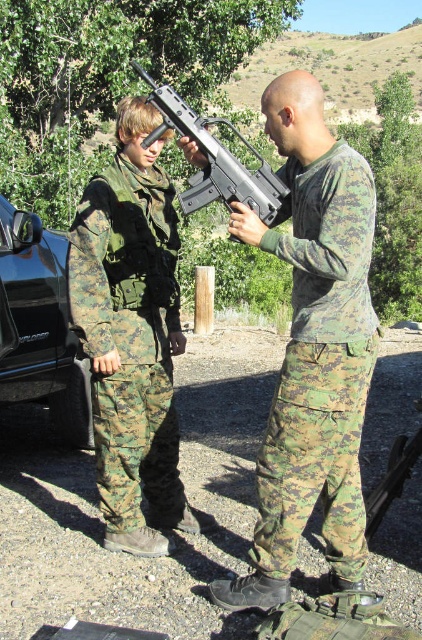
Can you confirm if camouflage fabric uniform at left is positioned to the left of black glossy car at left?

In fact, camouflage fabric uniform at left is to the right of black glossy car at left.

Is point (126, 259) positioned in front of point (62, 385)?

That is True.

Which is behind, point (172, 403) or point (34, 321)?

Positioned behind is point (34, 321).

The image size is (422, 640). Find the location of `camouflage fabric uniform at left`. camouflage fabric uniform at left is located at coordinates (129, 333).

Between point (173, 189) and point (226, 148), which one is positioned in front?

Positioned in front is point (226, 148).

Does camouflage fabric uniform at left come behind metallic gray rifle at center?

Yes, it is.

Locate an element on the screen. Image resolution: width=422 pixels, height=640 pixels. camouflage fabric uniform at left is located at coordinates (129, 333).

This screenshot has width=422, height=640. Find the location of `camouflage fabric uniform at left`. camouflage fabric uniform at left is located at coordinates (129, 333).

You are a GUI agent. You are given a task and a screenshot of the screen. Output one action in this format:
    pyautogui.click(x=<x>, y=<y>)
    Task: Click on the camouflage fabric pants at center
    The height and width of the screenshot is (640, 422).
    Given the screenshot: What is the action you would take?
    pyautogui.click(x=321, y=365)